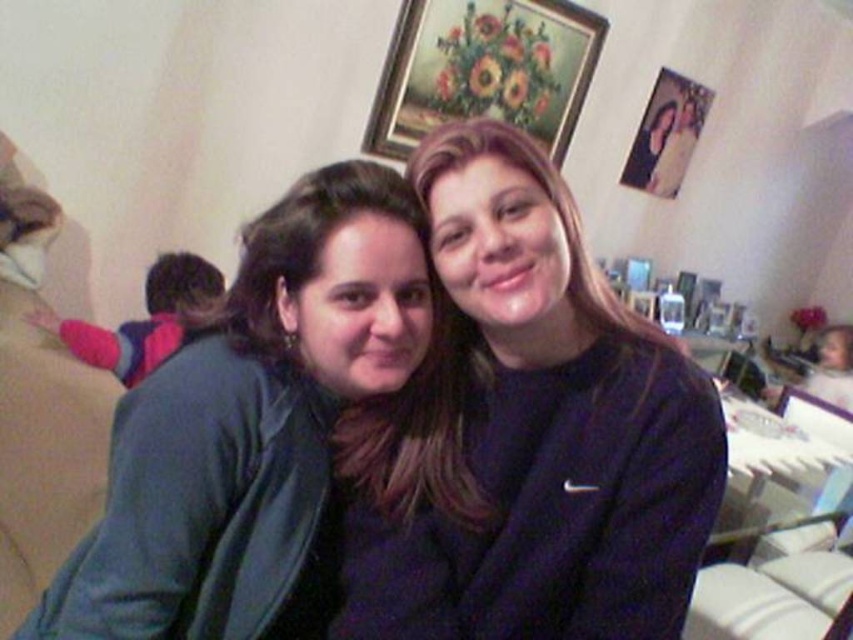
Does pink fleece jacket at left have a greater width compared to matte wooden photo frame at upper right?

Incorrect, pink fleece jacket at left's width does not surpass matte wooden photo frame at upper right's.

The height and width of the screenshot is (640, 853). I want to click on pink fleece jacket at left, so click(146, 320).

Is point (158, 353) farther from camera compared to point (685, 136)?

No, it is in front of (685, 136).

Identify the location of pink fleece jacket at left. (146, 320).

Is point (318, 320) positioned after point (693, 81)?

That is False.

Can you confirm if matte green jacket at left is positioned above matte wooden photo frame at upper right?

No, matte green jacket at left is not above matte wooden photo frame at upper right.

Who is more distant from viewer, (138, 509) or (699, 84)?

Positioned behind is point (699, 84).

In order to click on matte green jacket at left in this screenshot , I will do click(257, 426).

Consider the image. Is matte green jacket at left wider than wooden framed floral painting at upper center?

Incorrect, matte green jacket at left's width does not surpass wooden framed floral painting at upper center's.

Between point (268, 612) and point (419, 52), which one is positioned behind?

Point (419, 52)

Which is behind, point (398, 296) or point (386, 76)?

The point (386, 76) is more distant.

At what (x,y) coordinates should I click in order to perform the action: click on matte green jacket at left. Please return your answer as a coordinate pair (x, y). The width and height of the screenshot is (853, 640). Looking at the image, I should click on point(257,426).